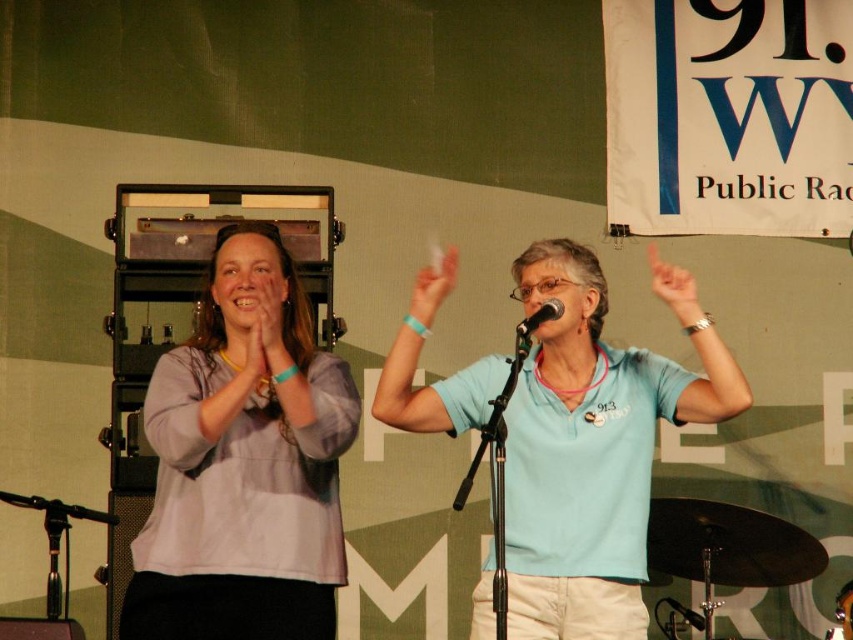
Is matte gray shirt at center smaller than black matte microphone at center?

Incorrect, matte gray shirt at center is not smaller in size than black matte microphone at center.

Who is more distant from viewer, (270, 353) or (547, 310)?

The point (547, 310) is more distant.

Is point (270, 339) positioned before point (525, 330)?

No.

This screenshot has height=640, width=853. Find the location of `matte gray shirt at center`. matte gray shirt at center is located at coordinates (270, 316).

Between light gray cotton shirt at center and matte skin finger at upper right, which one appears on the left side from the viewer's perspective?

From the viewer's perspective, light gray cotton shirt at center appears more on the left side.

Locate an element on the screen. light gray cotton shirt at center is located at coordinates (242, 467).

Between light gray cotton shirt at center and black matte microphone at center, which one appears on the left side from the viewer's perspective?

Positioned to the left is light gray cotton shirt at center.

Between light gray cotton shirt at center and black matte microphone at center, which one appears on the right side from the viewer's perspective?

black matte microphone at center

Is point (146, 566) positioned after point (556, 308)?

No, it is not.

Identify the location of light gray cotton shirt at center. (242, 467).